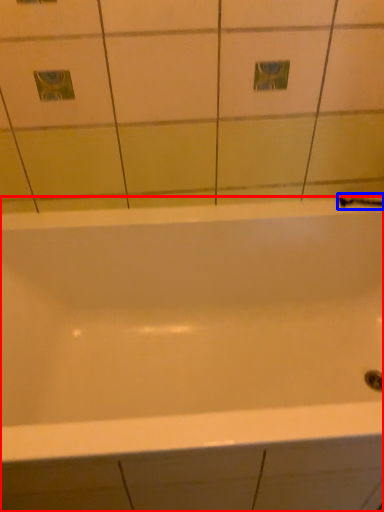
Question: Which of the following is the closest to the observer, bathtub (highlighted by a red box) or shower (highlighted by a blue box)?

Choices:
 (A) bathtub
 (B) shower

Answer: (A)